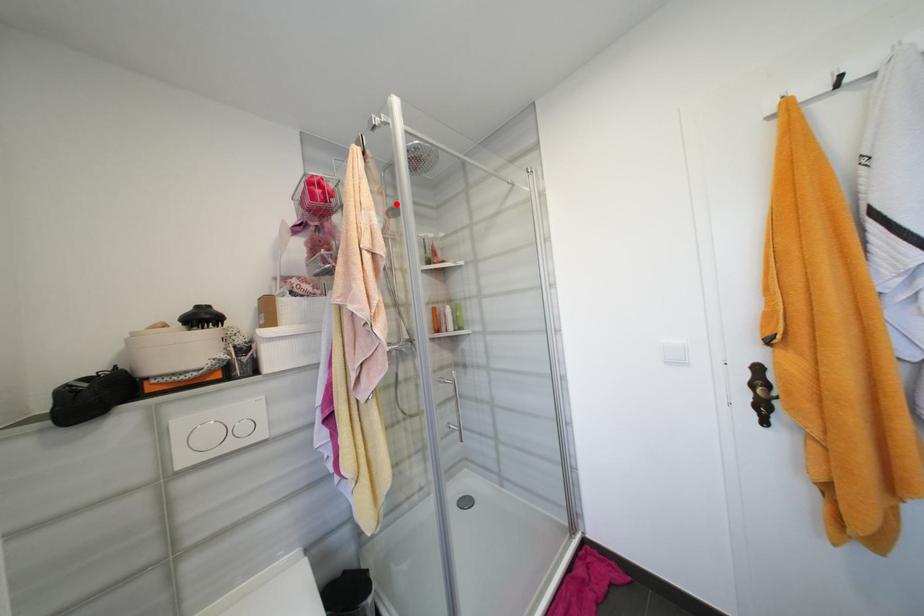
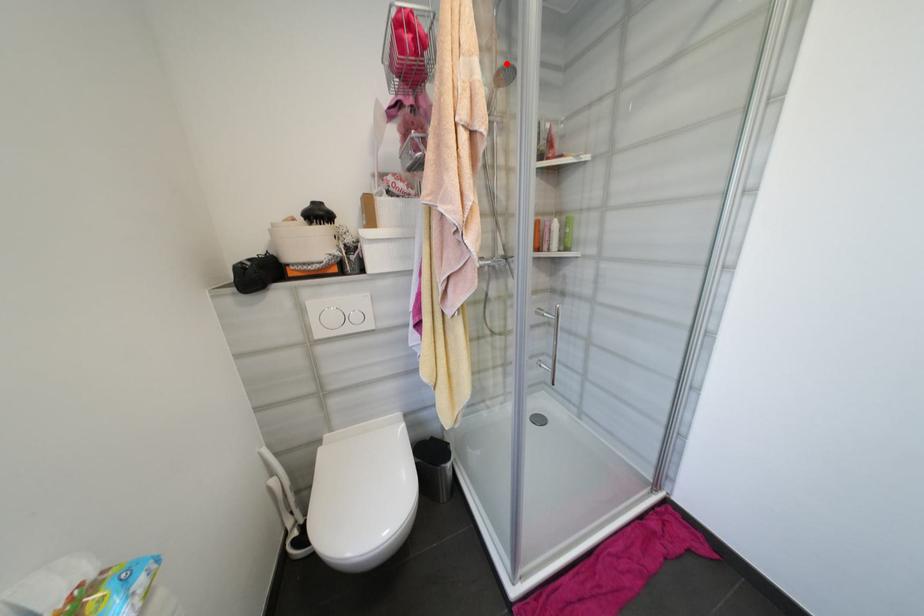
In the scene shown: I am providing you with two images of the same scene from different viewpoints. A red point is marked on the first image and another point is marked on the second image. Is the red point in image1 aligned with the point shown in image2?

Yes